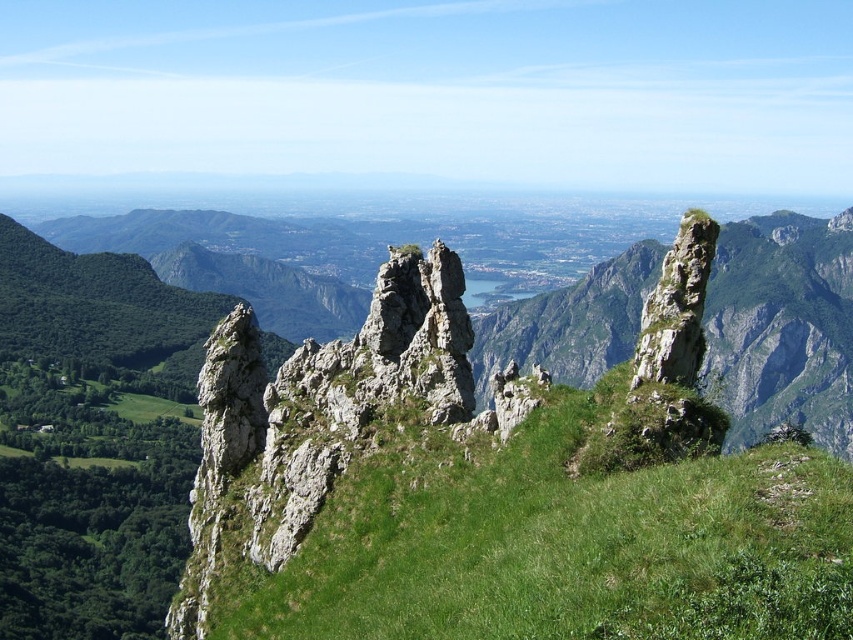
Question: Which point is farther to the camera?

Choices:
 (A) rough stone rock at right
 (B) green grassy at center

Answer: (A)

Question: Can you confirm if green grassy at center is bigger than rough stone rock at right?

Choices:
 (A) no
 (B) yes

Answer: (B)

Question: Is green grassy at center in front of rough stone rock at right?

Choices:
 (A) yes
 (B) no

Answer: (A)

Question: Among these objects, which one is farthest from the camera?

Choices:
 (A) green grassy at center
 (B) rough stone rock at right

Answer: (B)

Question: Which point appears closest to the camera in this image?

Choices:
 (A) (695, 294)
 (B) (643, 600)

Answer: (B)

Question: Does green grassy at center have a smaller size compared to rough stone rock at right?

Choices:
 (A) yes
 (B) no

Answer: (B)